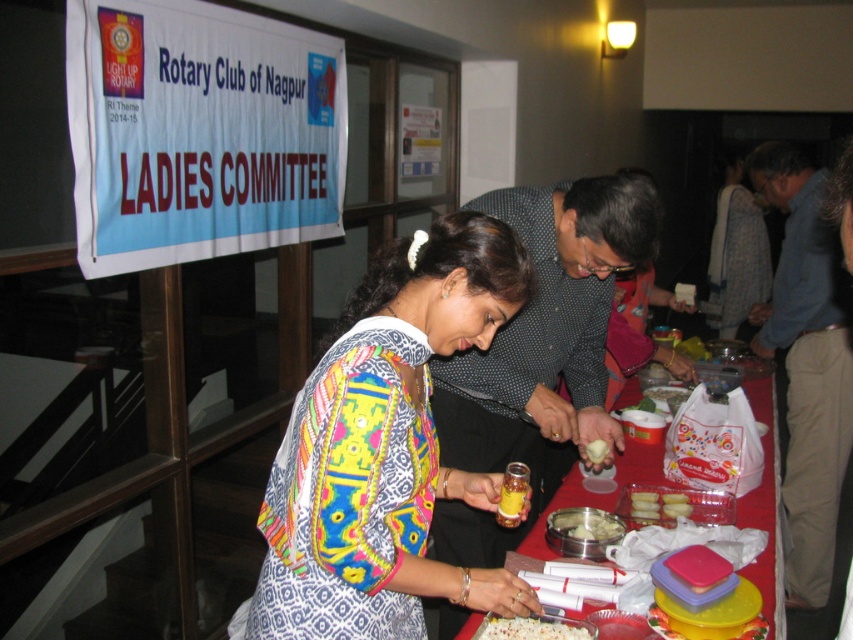
You are organizing a photo shoot at the event and need to position two volunteers wearing the blue cotton shirt at center and the patterned fabric dress at center. The photographer requires that the distance between them should be exactly 5 feet for the perfect shot. Based on the current setup, can they maintain the required distance without moving the table?

The distance between the blue cotton shirt at center and the patterned fabric dress at center is currently 4.70 feet. Since 4.70 feet is less than 5 feet, they would need to move slightly apart to achieve the required distance of exactly 5 feet.